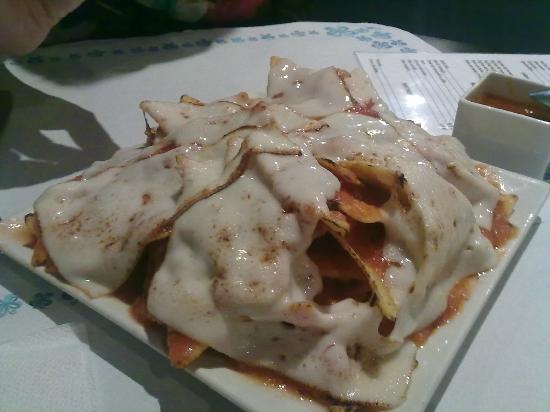
The height and width of the screenshot is (412, 550). I want to click on cup, so click(500, 134).